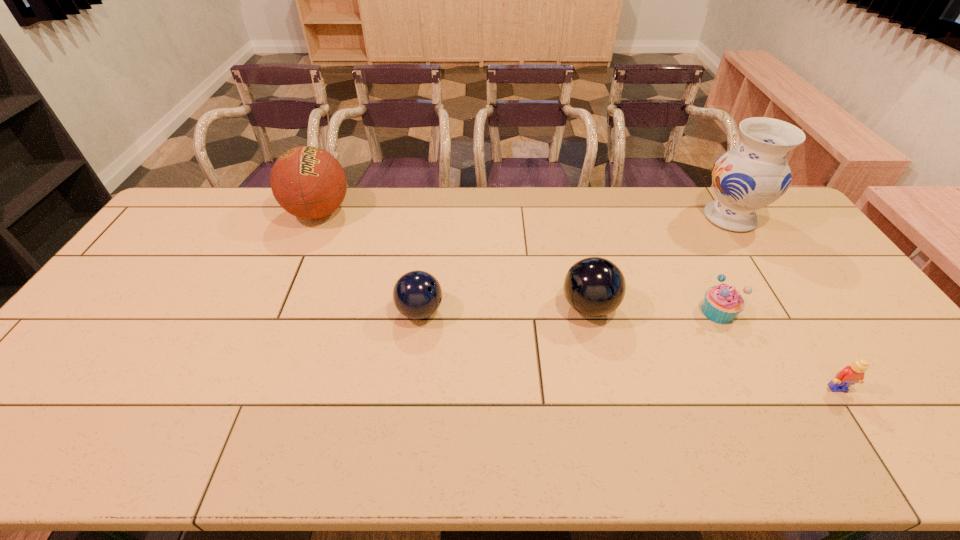
At what (x,y) coordinates should I click in order to perform the action: click on vacant area located on the left of the basketball. Please return your answer as a coordinate pair (x, y). Image resolution: width=960 pixels, height=540 pixels. Looking at the image, I should click on (248, 212).

You are a GUI agent. You are given a task and a screenshot of the screen. Output one action in this format:
    pyautogui.click(x=<x>, y=<y>)
    Task: Click on the blank space located on the side of the fourth object from right to left with the finger holes
    This screenshot has width=960, height=540.
    Given the screenshot: What is the action you would take?
    pyautogui.click(x=462, y=307)

Identify the location of vacant space positioned on the side of the fourth object from right to left with the finger holes. The width and height of the screenshot is (960, 540). (458, 307).

The height and width of the screenshot is (540, 960). I want to click on vacant space located on the side of the fourth object from right to left with the finger holes, so (472, 307).

At what (x,y) coordinates should I click in order to perform the action: click on vacant area situated on the surface of the fourth tallest object near the finger holes. Please return your answer as a coordinate pair (x, y). This screenshot has width=960, height=540. Looking at the image, I should click on (564, 311).

Find the location of `vacant space located 0.260m on the back of the muffin`. vacant space located 0.260m on the back of the muffin is located at coordinates (682, 240).

Locate an element on the screen. This screenshot has width=960, height=540. free space located on the front-facing side of the nearest object is located at coordinates (853, 412).

In order to click on vase situated at the far edge in this screenshot , I will do `click(754, 174)`.

At what (x,y) coordinates should I click in order to perform the action: click on basketball at the far edge. Please return your answer as a coordinate pair (x, y). This screenshot has width=960, height=540. Looking at the image, I should click on [308, 182].

Where is `object that is at the right edge`? The image size is (960, 540). object that is at the right edge is located at coordinates (754, 174).